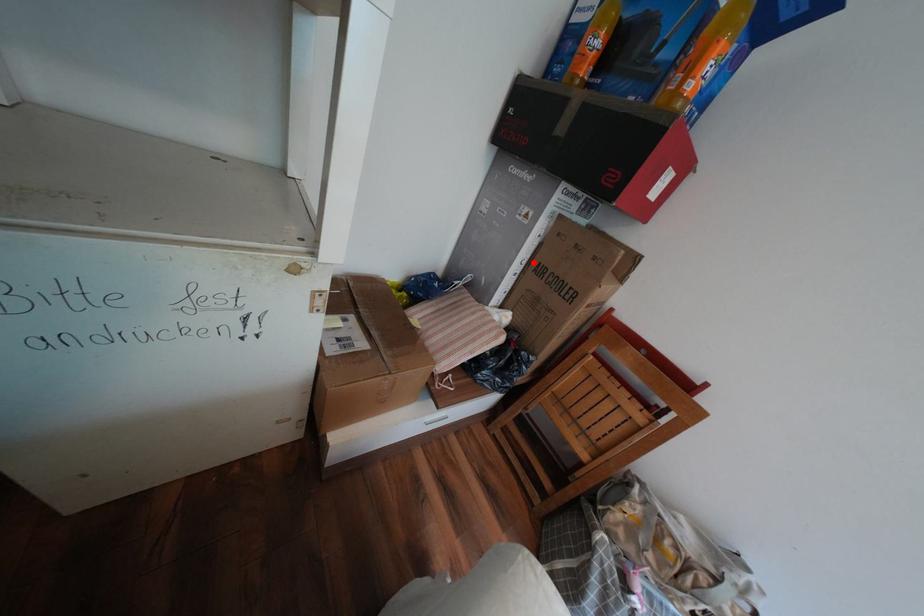
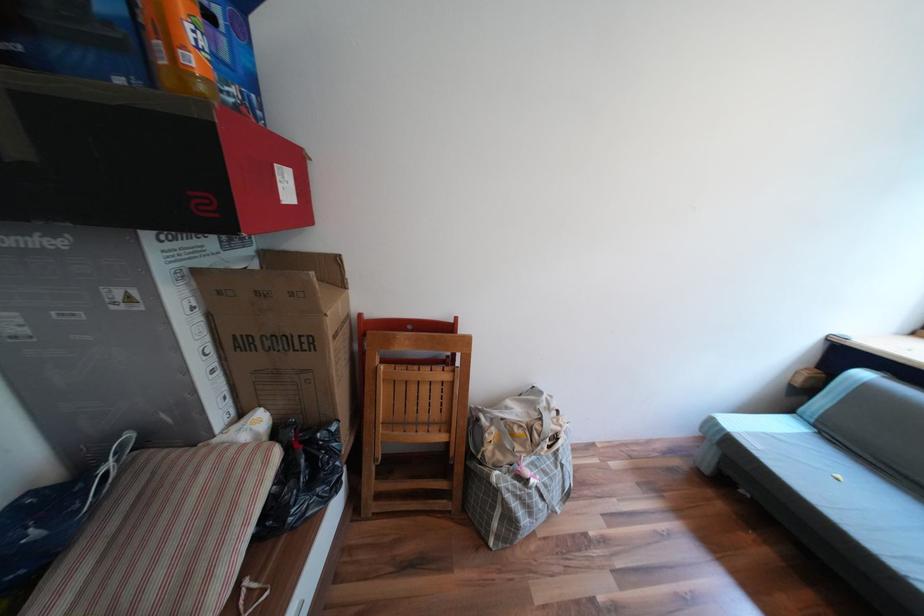
In the second image, find the point that corresponds to the highlighted location in the first image.

(219, 349)